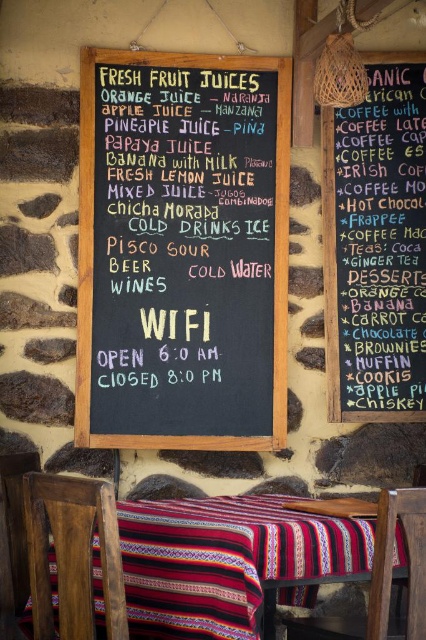
Question: Among these objects, which one is nearest to the camera?

Choices:
 (A) black chalkboard at center
 (B) black chalkboard menu at upper right

Answer: (A)

Question: Where is striped fabric tablecloth at lower center located in relation to wooden chair at lower center in the image?

Choices:
 (A) below
 (B) above

Answer: (B)

Question: Does black chalkboard menu at upper right appear on the right side of dark brown wooden chair at lower left?

Choices:
 (A) yes
 (B) no

Answer: (A)

Question: Estimate the real-world distances between objects in this image. Which object is closer to the wooden chair at lower center?

Choices:
 (A) black chalkboard at center
 (B) dark brown wooden chair at lower left
 (C) striped fabric tablecloth at lower center
 (D) black chalkboard menu at upper right

Answer: (C)

Question: Which point is farther from the camera taking this photo?

Choices:
 (A) (408, 332)
 (B) (331, 516)

Answer: (A)

Question: From the image, what is the correct spatial relationship of black chalkboard at center in relation to black chalkboard menu at upper right?

Choices:
 (A) above
 (B) below

Answer: (B)